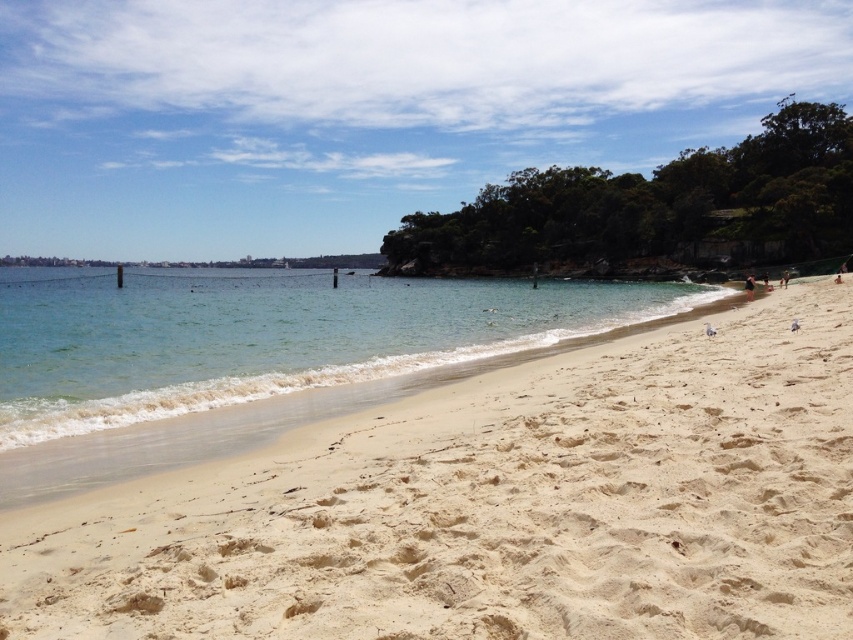
Question: Which object appears closest to the camera in this image?

Choices:
 (A) black fabric person at lower right
 (B) light beige sand at lower center
 (C) clear water at beach center
 (D) light brown sand at upper right

Answer: (B)

Question: Is clear water at beach center further to the viewer compared to black fabric person at lower right?

Choices:
 (A) no
 (B) yes

Answer: (A)

Question: Does black fabric person at lower right have a larger size compared to light brown sand at upper right?

Choices:
 (A) yes
 (B) no

Answer: (A)

Question: Does light beige sand at lower center lie in front of black fabric person at lower right?

Choices:
 (A) no
 (B) yes

Answer: (B)

Question: Which point is closer to the camera taking this photo?

Choices:
 (A) (780, 284)
 (B) (18, 314)
 (C) (752, 292)
 (D) (653, 630)

Answer: (D)

Question: Among these points, which one is nearest to the camera?

Choices:
 (A) (670, 595)
 (B) (749, 284)

Answer: (A)